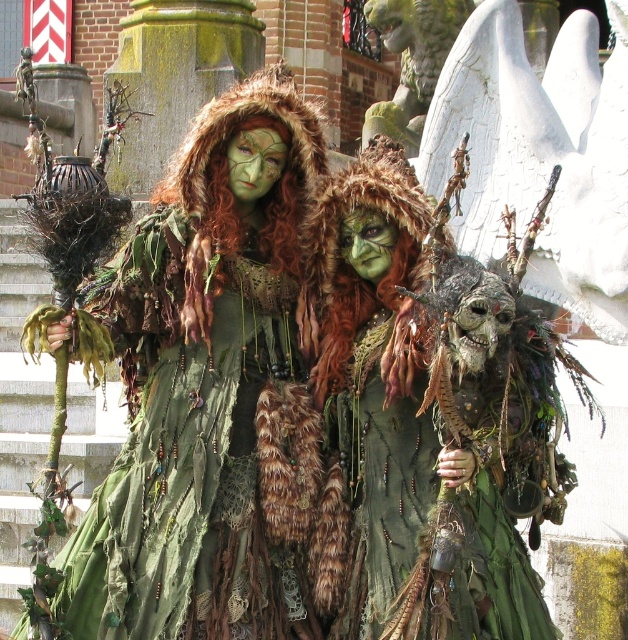
What do you see at coordinates (210, 388) in the screenshot?
I see `green matte fur coat at center` at bounding box center [210, 388].

Is the position of green matte fur coat at center more distant than that of fur-covered mask at center?

Yes.

Describe the element at coordinates (210, 388) in the screenshot. This screenshot has width=628, height=640. I see `green matte fur coat at center` at that location.

At what (x,y) coordinates should I click in order to perform the action: click on green matte fur coat at center. Please return your answer as a coordinate pair (x, y). Image resolution: width=628 pixels, height=640 pixels. Looking at the image, I should click on (210, 388).